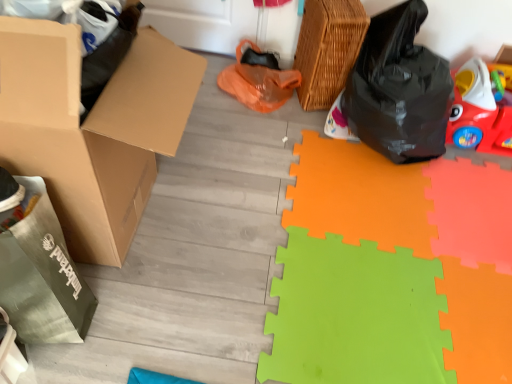
This screenshot has height=384, width=512. I want to click on free space to the left of green foam mat at lower right, so click(220, 235).